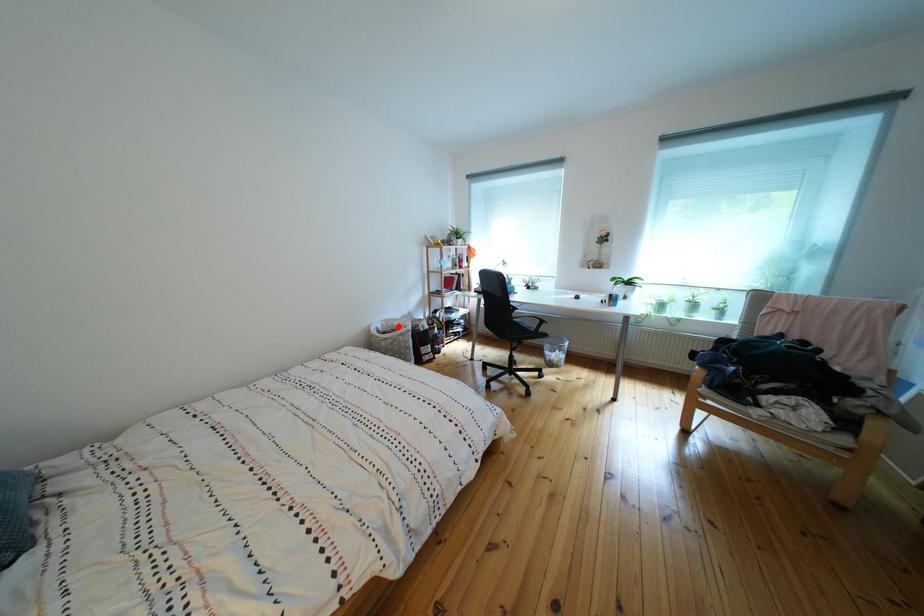
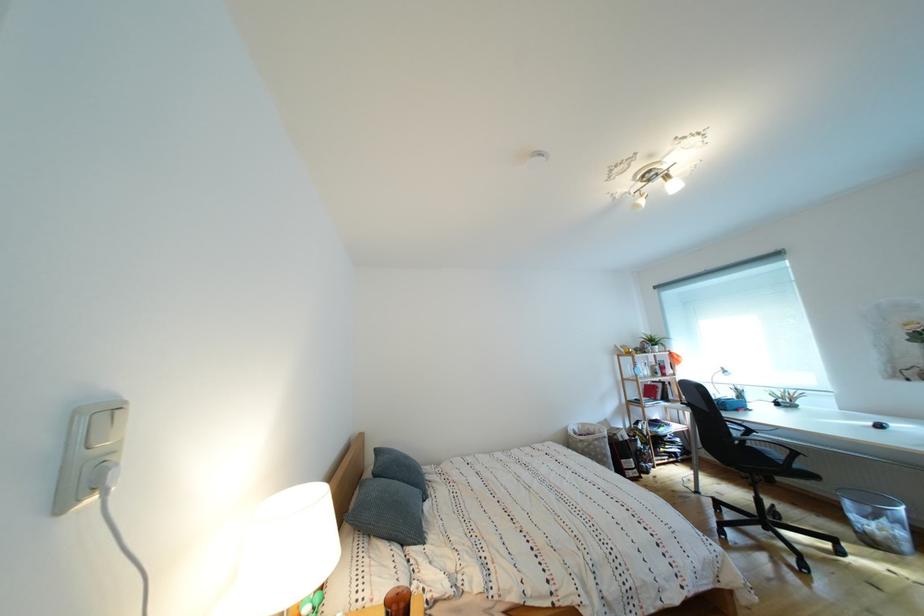
Locate, in the second image, the point that corresponds to the highlighted location in the first image.

(594, 430)